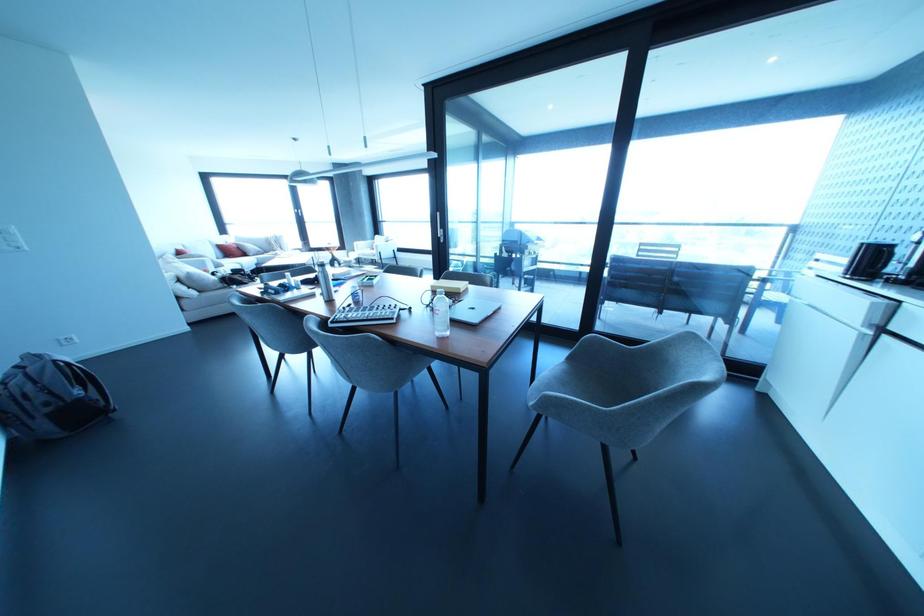
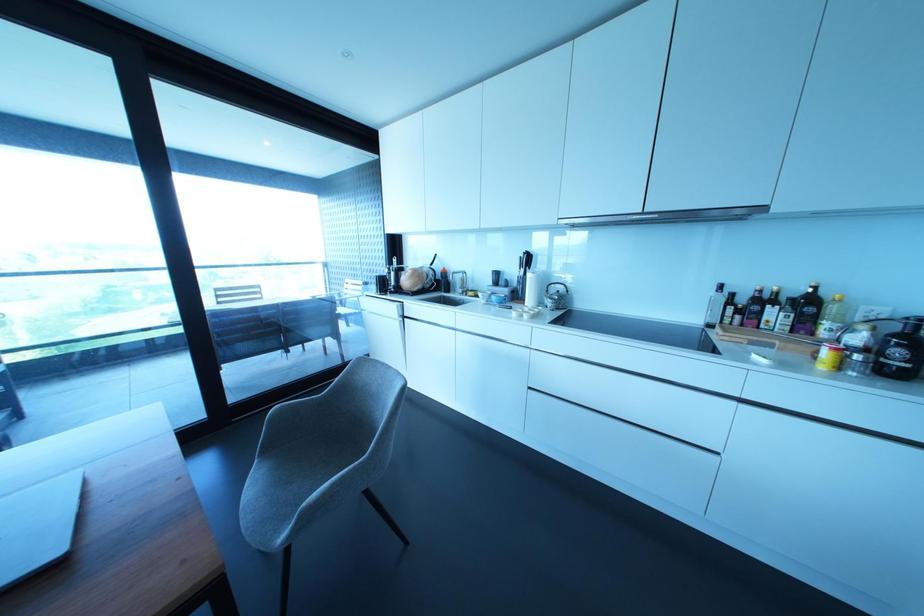
Locate, in the second image, the point that corresponds to point (555, 397) in the first image.

(323, 493)